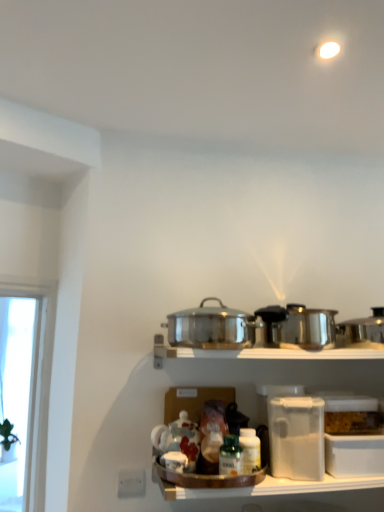
Question: Is shiny metallic crock pot at right, which ranks as the 1th crock pot in right-to-left order, next to clear plastic container at lower right?

Choices:
 (A) no
 (B) yes

Answer: (A)

Question: Can you confirm if shiny metallic crock pot at right, the 2th crock pot in the left-to-right sequence, is wider than clear plastic container at lower right?

Choices:
 (A) yes
 (B) no

Answer: (A)

Question: Is shiny metallic crock pot at right, which ranks as the 1th crock pot in right-to-left order, oriented away from clear plastic container at lower right?

Choices:
 (A) no
 (B) yes

Answer: (A)

Question: Does shiny metallic crock pot at right, which ranks as the 1th crock pot in right-to-left order, have a greater height compared to clear plastic container at lower right?

Choices:
 (A) no
 (B) yes

Answer: (A)

Question: Is shiny metallic crock pot at right, the 2th crock pot in the left-to-right sequence, thinner than clear plastic container at lower right?

Choices:
 (A) no
 (B) yes

Answer: (A)

Question: Is shiny metallic crock pot at right, the 2th crock pot in the left-to-right sequence, wider or thinner than green glass bottle at center?

Choices:
 (A) wide
 (B) thin

Answer: (A)

Question: Choose the correct answer: Is shiny metallic crock pot at right, which ranks as the 1th crock pot in right-to-left order, inside green glass bottle at center or outside it?

Choices:
 (A) outside
 (B) inside

Answer: (A)

Question: Considering the positions of shiny metallic crock pot at right, which ranks as the 1th crock pot in right-to-left order, and green glass bottle at center in the image, is shiny metallic crock pot at right, which ranks as the 1th crock pot in right-to-left order, taller or shorter than green glass bottle at center?

Choices:
 (A) short
 (B) tall

Answer: (B)

Question: From the image's perspective, is shiny metallic crock pot at right, which ranks as the 1th crock pot in right-to-left order, above or below green glass bottle at center?

Choices:
 (A) below
 (B) above

Answer: (B)

Question: From the image's perspective, is green glass bottle at center positioned above or below shiny metallic crock pot at right, the 2th crock pot in the left-to-right sequence?

Choices:
 (A) above
 (B) below

Answer: (B)

Question: Is green glass bottle at center wider or thinner than shiny metallic crock pot at right, the 2th crock pot in the left-to-right sequence?

Choices:
 (A) wide
 (B) thin

Answer: (B)

Question: Relative to shiny metallic crock pot at right, the 2th crock pot in the left-to-right sequence, is green glass bottle at center in front or behind?

Choices:
 (A) behind
 (B) front

Answer: (B)

Question: From a real-world perspective, relative to shiny metallic crock pot at right, the 2th crock pot in the left-to-right sequence, is green glass bottle at center vertically above or below?

Choices:
 (A) below
 (B) above

Answer: (A)

Question: Considering the positions of shiny metallic crock pot at right, the 2th crock pot in the left-to-right sequence, and polished stainless steel pot at center, the first crock pot from the left, in the image, is shiny metallic crock pot at right, the 2th crock pot in the left-to-right sequence, taller or shorter than polished stainless steel pot at center, the first crock pot from the left,?

Choices:
 (A) tall
 (B) short

Answer: (B)

Question: Is shiny metallic crock pot at right, the 2th crock pot in the left-to-right sequence, to the left or to the right of polished stainless steel pot at center, the first crock pot from the left, in the image?

Choices:
 (A) left
 (B) right

Answer: (B)